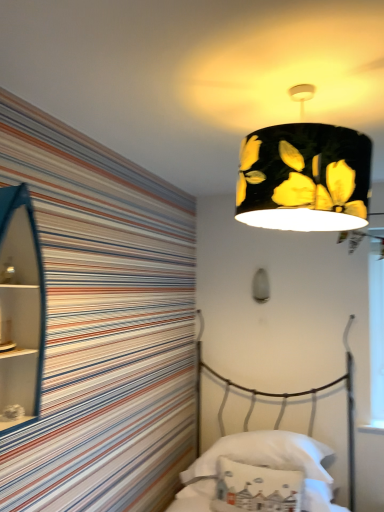
Question: From a real-world perspective, is black matte lampshade at upper center, which ranks as the second lamp in bottom-to-top order, beneath blue glossy cabinet at left?

Choices:
 (A) yes
 (B) no

Answer: (B)

Question: Does black matte lampshade at upper center, which ranks as the second lamp in back-to-front order, have a greater height compared to blue glossy cabinet at left?

Choices:
 (A) no
 (B) yes

Answer: (A)

Question: Does black matte lampshade at upper center, which ranks as the second lamp in bottom-to-top order, have a lesser width compared to blue glossy cabinet at left?

Choices:
 (A) no
 (B) yes

Answer: (A)

Question: From the image's perspective, is black matte lampshade at upper center, which ranks as the second lamp in bottom-to-top order, below blue glossy cabinet at left?

Choices:
 (A) no
 (B) yes

Answer: (A)

Question: Is black matte lampshade at upper center, which ranks as the second lamp in back-to-front order, positioned in front of blue glossy cabinet at left?

Choices:
 (A) yes
 (B) no

Answer: (A)

Question: Relative to blue glossy cabinet at left, is white fabric pillow at lower center, which is the 1th pillow in front-to-back order, in front or behind?

Choices:
 (A) front
 (B) behind

Answer: (B)

Question: Would you say white fabric pillow at lower center, which is the 1th pillow in front-to-back order, is to the left or to the right of blue glossy cabinet at left in the picture?

Choices:
 (A) left
 (B) right

Answer: (B)

Question: Is white fabric pillow at lower center, which is the 1th pillow in front-to-back order, taller or shorter than blue glossy cabinet at left?

Choices:
 (A) tall
 (B) short

Answer: (B)

Question: From the image's perspective, is white fabric pillow at lower center, which is the 1th pillow in front-to-back order, located above or below blue glossy cabinet at left?

Choices:
 (A) above
 (B) below

Answer: (B)

Question: Is point (370, 331) positioned closer to the camera than point (36, 349)?

Choices:
 (A) closer
 (B) farther

Answer: (B)

Question: From their relative heights in the image, would you say transparent plastic window screen at right is taller or shorter than blue glossy cabinet at left?

Choices:
 (A) tall
 (B) short

Answer: (A)

Question: Is transparent plastic window screen at right to the left or to the right of blue glossy cabinet at left in the image?

Choices:
 (A) right
 (B) left

Answer: (A)

Question: From a real-world perspective, is transparent plastic window screen at right physically located above or below blue glossy cabinet at left?

Choices:
 (A) above
 (B) below

Answer: (B)

Question: Considering the positions of black matte lampshade at upper center, arranged as the 1th lamp when viewed from the front, and white fabric pillow at lower center, acting as the first pillow starting from the back, in the image, is black matte lampshade at upper center, arranged as the 1th lamp when viewed from the front, wider or thinner than white fabric pillow at lower center, acting as the first pillow starting from the back,?

Choices:
 (A) wide
 (B) thin

Answer: (B)

Question: Relative to white fabric pillow at lower center, acting as the first pillow starting from the back, is black matte lampshade at upper center, which ranks as the second lamp in bottom-to-top order, in front or behind?

Choices:
 (A) front
 (B) behind

Answer: (A)